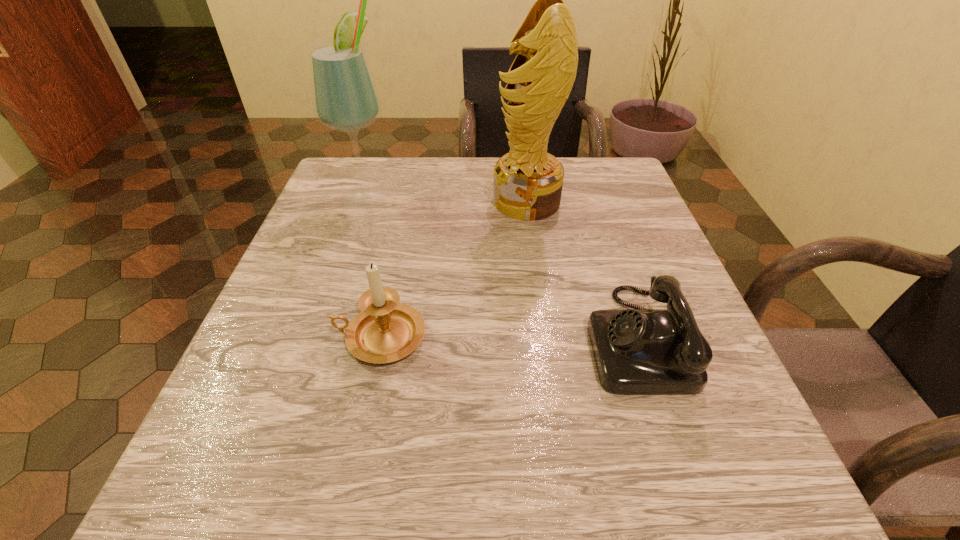
The image size is (960, 540). Identify the location of blank region between the telephone and the alcohol. (501, 266).

At what (x,y) coordinates should I click in order to perform the action: click on free space between the candle holder and the award. Please return your answer as a coordinate pair (x, y). The image size is (960, 540). Looking at the image, I should click on (453, 269).

Locate an element on the screen. vacant area that lies between the alcohol and the shortest object is located at coordinates (501, 266).

Identify the location of free point between the award and the alcohol. Image resolution: width=960 pixels, height=540 pixels. (447, 198).

Locate an element on the screen. free spot between the telephone and the award is located at coordinates (581, 270).

Find the location of a particular element. The width and height of the screenshot is (960, 540). blank region between the candle holder and the telephone is located at coordinates point(508,338).

Select which object is the second closest to the alcohol. Please provide its 2D coordinates. Your answer should be formatted as a tuple, i.e. [(x, y)], where the tuple contains the x and y coordinates of a point satisfying the conditions above.

[(385, 331)]

This screenshot has height=540, width=960. I want to click on the closest object to the alcohol, so click(528, 181).